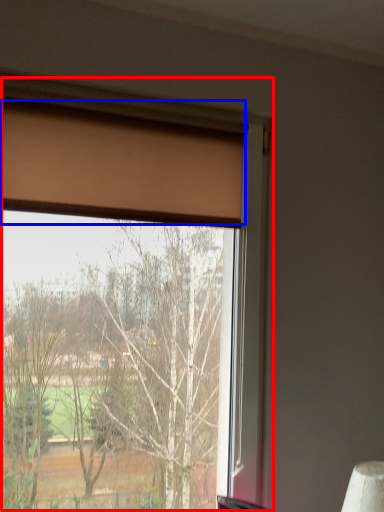
Question: Which point is further to the camera, window (highlighted by a red box) or curtain (highlighted by a blue box)?

Choices:
 (A) window
 (B) curtain

Answer: (B)